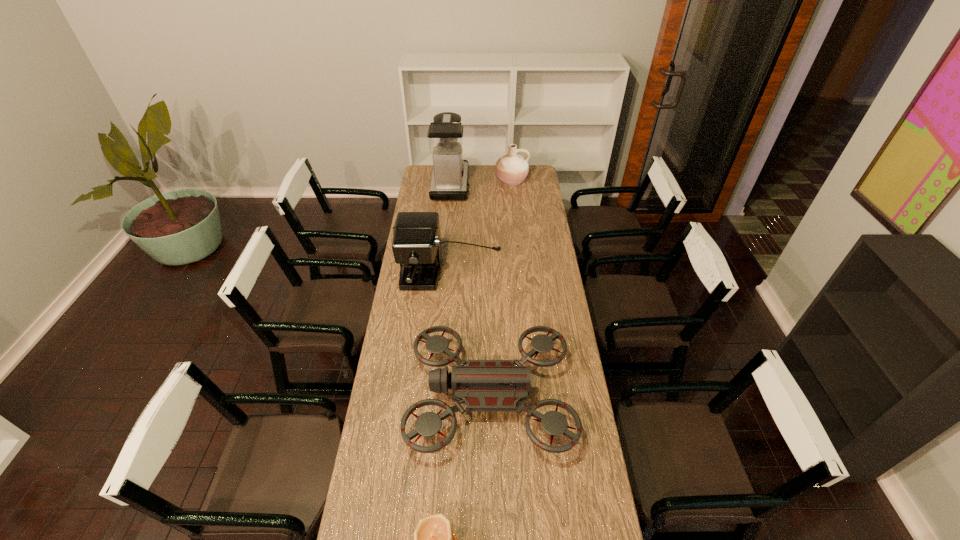
The width and height of the screenshot is (960, 540). What are the coordinates of `free space located on the front-facing side of the fourth farthest object` in the screenshot? It's located at (377, 397).

This screenshot has height=540, width=960. I want to click on coffee maker that is at the far edge, so click(449, 181).

The height and width of the screenshot is (540, 960). Find the location of `pottery present at the far edge`. pottery present at the far edge is located at coordinates (511, 169).

This screenshot has width=960, height=540. In order to click on drone present at the left edge in this screenshot , I will do `click(482, 385)`.

Locate an element on the screen. Image resolution: width=960 pixels, height=540 pixels. pottery present at the right edge is located at coordinates (511, 169).

The width and height of the screenshot is (960, 540). Find the location of `drone located in the right edge section of the desktop`. drone located in the right edge section of the desktop is located at coordinates (482, 385).

The image size is (960, 540). Find the location of `object that is at the far left corner`. object that is at the far left corner is located at coordinates (449, 181).

You are a GUI agent. You are given a task and a screenshot of the screen. Output one action in this format:
    pyautogui.click(x=<x>, y=<y>)
    Task: Click on the object at the far right corner
    The image size is (960, 540).
    Given the screenshot: What is the action you would take?
    pyautogui.click(x=511, y=169)

Where is `free space at the left edge of the desktop`? This screenshot has width=960, height=540. free space at the left edge of the desktop is located at coordinates (428, 197).

Find the location of `free spot at the right edge of the desktop`. free spot at the right edge of the desktop is located at coordinates (574, 353).